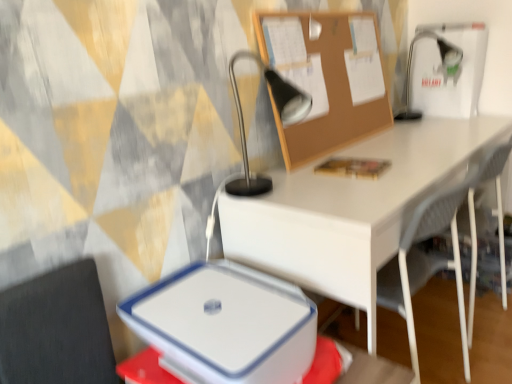
Locate an element on the screen. burlap corkboard at upper center is located at coordinates (327, 78).

Measure the distance between white plastic lunch box at lower center and camera.

They are 30.77 inches apart.

What do you see at coordinates (280, 118) in the screenshot? I see `metallic silver table lamp at upper center, the 2th table lamp in the right-to-left sequence` at bounding box center [280, 118].

Where is `white mesh chair at lower right`? white mesh chair at lower right is located at coordinates (426, 263).

From the picture: Is metallic silver table lamp at upper right, the second table lamp in the left-to-right sequence, at the back of white mesh chair at lower right?

That's not correct — white mesh chair at lower right is not looking away from metallic silver table lamp at upper right, the second table lamp in the left-to-right sequence.

Is white mesh chair at lower right thinner than metallic silver table lamp at upper right, marked as the 1th table lamp in a back-to-front arrangement?

In fact, white mesh chair at lower right might be wider than metallic silver table lamp at upper right, marked as the 1th table lamp in a back-to-front arrangement.

Can you confirm if white mesh chair at lower right is shorter than metallic silver table lamp at upper right, the second table lamp in the left-to-right sequence?

No, white mesh chair at lower right is not shorter than metallic silver table lamp at upper right, the second table lamp in the left-to-right sequence.

From the image's perspective, is white mesh chair at lower right above metallic silver table lamp at upper right, positioned as the second table lamp in front-to-back order?

Incorrect, from the image's perspective, white mesh chair at lower right is lower than metallic silver table lamp at upper right, positioned as the second table lamp in front-to-back order.

Is metallic silver table lamp at upper right, marked as the 1th table lamp in a back-to-front arrangement, a part of white plastic lunch box at lower center?

Definitely not — metallic silver table lamp at upper right, marked as the 1th table lamp in a back-to-front arrangement, is not inside white plastic lunch box at lower center.

Is white plastic lunch box at lower center taller than metallic silver table lamp at upper right, placed as the 1th table lamp when sorted from right to left?

Incorrect, the height of white plastic lunch box at lower center is not larger of that of metallic silver table lamp at upper right, placed as the 1th table lamp when sorted from right to left.

Considering the positions of objects white plastic lunch box at lower center and metallic silver table lamp at upper right, the second table lamp in the left-to-right sequence, in the image provided, who is more to the left, white plastic lunch box at lower center or metallic silver table lamp at upper right, the second table lamp in the left-to-right sequence,?

white plastic lunch box at lower center.

Is white plastic lunch box at lower center oriented towards metallic silver table lamp at upper right, the second table lamp in the left-to-right sequence?

No, white plastic lunch box at lower center does not turn towards metallic silver table lamp at upper right, the second table lamp in the left-to-right sequence.

Which object is positioned more to the left, burlap corkboard at upper center or white plastic lunch box at lower center?

white plastic lunch box at lower center is more to the left.

Between burlap corkboard at upper center and white plastic lunch box at lower center, which one has larger size?

Bigger between the two is white plastic lunch box at lower center.

From a real-world perspective, does burlap corkboard at upper center sit lower than white plastic lunch box at lower center?

No.

How far apart are metallic silver table lamp at upper center, acting as the 1th table lamp starting from the front, and white mesh chair at lower right?

metallic silver table lamp at upper center, acting as the 1th table lamp starting from the front, is 58.10 centimeters away from white mesh chair at lower right.

Between metallic silver table lamp at upper center, acting as the 1th table lamp starting from the front, and white mesh chair at lower right, which one has smaller width?

metallic silver table lamp at upper center, acting as the 1th table lamp starting from the front, is thinner.

From a real-world perspective, between metallic silver table lamp at upper center, the 2th table lamp in the right-to-left sequence, and white mesh chair at lower right, who is vertically higher?

metallic silver table lamp at upper center, the 2th table lamp in the right-to-left sequence, is physically above.

Is metallic silver table lamp at upper center, acting as the 1th table lamp starting from the front, placed right next to white mesh chair at lower right?

No, metallic silver table lamp at upper center, acting as the 1th table lamp starting from the front, is not with white mesh chair at lower right.

You are a GUI agent. You are given a task and a screenshot of the screen. Output one action in this format:
    pyautogui.click(x=<x>, y=<y>)
    Task: Click on the lunch box below the metallic silver table lamp at upper right, placed as the 1th table lamp when sorted from right to left (from a real-world perspective)
    This screenshot has height=384, width=512.
    Given the screenshot: What is the action you would take?
    pyautogui.click(x=227, y=323)

Can you confirm if metallic silver table lamp at upper right, the second table lamp in the left-to-right sequence, is wider than white plastic lunch box at lower center?

Indeed, metallic silver table lamp at upper right, the second table lamp in the left-to-right sequence, has a greater width compared to white plastic lunch box at lower center.

Is metallic silver table lamp at upper right, positioned as the second table lamp in front-to-back order, aimed at white plastic lunch box at lower center?

No, metallic silver table lamp at upper right, positioned as the second table lamp in front-to-back order, is not turned towards white plastic lunch box at lower center.

Considering the sizes of metallic silver table lamp at upper right, placed as the 1th table lamp when sorted from right to left, and white plastic lunch box at lower center in the image, is metallic silver table lamp at upper right, placed as the 1th table lamp when sorted from right to left, taller or shorter than white plastic lunch box at lower center?

In the image, metallic silver table lamp at upper right, placed as the 1th table lamp when sorted from right to left, appears to be taller than white plastic lunch box at lower center.

In terms of size, does burlap corkboard at upper center appear bigger or smaller than metallic silver table lamp at upper center, the 2th table lamp in the right-to-left sequence?

burlap corkboard at upper center is smaller than metallic silver table lamp at upper center, the 2th table lamp in the right-to-left sequence.

Is point (332, 91) positioned after point (301, 115)?

Yes, point (332, 91) is farther from viewer.

Find the location of a particular element. table lamp located below the burlap corkboard at upper center (from the image's perspective) is located at coordinates (280, 118).

Based on their sizes in the image, would you say metallic silver table lamp at upper center, the 2th table lamp in the right-to-left sequence, is bigger or smaller than metallic silver table lamp at upper right, positioned as the second table lamp in front-to-back order?

metallic silver table lamp at upper center, the 2th table lamp in the right-to-left sequence, is bigger than metallic silver table lamp at upper right, positioned as the second table lamp in front-to-back order.

Is metallic silver table lamp at upper right, the second table lamp in the left-to-right sequence, at the back of metallic silver table lamp at upper center, which is the 2th table lamp in back-to-front order?

That's not correct — metallic silver table lamp at upper center, which is the 2th table lamp in back-to-front order, is not looking away from metallic silver table lamp at upper right, the second table lamp in the left-to-right sequence.

From the image's perspective, does metallic silver table lamp at upper center, which is counted as the first table lamp, starting from the left, appear lower than metallic silver table lamp at upper right, marked as the 1th table lamp in a back-to-front arrangement?

Yes, from the image's perspective, metallic silver table lamp at upper center, which is counted as the first table lamp, starting from the left, is below metallic silver table lamp at upper right, marked as the 1th table lamp in a back-to-front arrangement.

Does metallic silver table lamp at upper center, acting as the 1th table lamp starting from the front, come behind metallic silver table lamp at upper right, positioned as the second table lamp in front-to-back order?

No, the depth of metallic silver table lamp at upper center, acting as the 1th table lamp starting from the front, is less than that of metallic silver table lamp at upper right, positioned as the second table lamp in front-to-back order.

Identify the location of armchair that is on the left side of metallic silver table lamp at upper right, marked as the 1th table lamp in a back-to-front arrangement. Image resolution: width=512 pixels, height=384 pixels. (426, 263).

From a real-world perspective, count 2nd table lamps upward from the white plastic lunch box at lower center and point to it. Please provide its 2D coordinates.

[(440, 67)]

Considering their positions, is burlap corkboard at upper center positioned further to metallic silver table lamp at upper center, acting as the 1th table lamp starting from the front, than white plastic lunch box at lower center?

white plastic lunch box at lower center lies further to metallic silver table lamp at upper center, acting as the 1th table lamp starting from the front, than the other object.

Consider the image. Estimate the real-world distances between objects in this image. Which object is closer to white mesh chair at lower right, metallic silver table lamp at upper center, which is the 2th table lamp in back-to-front order, or white plastic lunch box at lower center?

white plastic lunch box at lower center is positioned closer to the anchor white mesh chair at lower right.

From the image, which object appears to be farther from white mesh chair at lower right, white plastic lunch box at lower center or burlap corkboard at upper center?

burlap corkboard at upper center.

From the image, which object appears to be nearer to white mesh chair at lower right, burlap corkboard at upper center or metallic silver table lamp at upper right, the second table lamp in the left-to-right sequence?

burlap corkboard at upper center is closer to white mesh chair at lower right.

Estimate the real-world distances between objects in this image. Which object is further from white plastic lunch box at lower center, metallic silver table lamp at upper center, which is counted as the first table lamp, starting from the left, or metallic silver table lamp at upper right, marked as the 1th table lamp in a back-to-front arrangement?

Based on the image, metallic silver table lamp at upper right, marked as the 1th table lamp in a back-to-front arrangement, appears to be further to white plastic lunch box at lower center.

Estimate the real-world distances between objects in this image. Which object is further from burlap corkboard at upper center, white mesh chair at lower right or white plastic lunch box at lower center?

Based on the image, white plastic lunch box at lower center appears to be further to burlap corkboard at upper center.

Which object lies further to the anchor point metallic silver table lamp at upper center, the 2th table lamp in the right-to-left sequence, white mesh chair at lower right or metallic silver table lamp at upper right, the second table lamp in the left-to-right sequence?

Among the two, metallic silver table lamp at upper right, the second table lamp in the left-to-right sequence, is located further to metallic silver table lamp at upper center, the 2th table lamp in the right-to-left sequence.

Considering their positions, is white plastic lunch box at lower center positioned closer to metallic silver table lamp at upper center, the 2th table lamp in the right-to-left sequence, than metallic silver table lamp at upper right, placed as the 1th table lamp when sorted from right to left?

white plastic lunch box at lower center.

Locate an element on the screen. The width and height of the screenshot is (512, 384). table lamp between white plastic lunch box at lower center and metallic silver table lamp at upper right, positioned as the second table lamp in front-to-back order, from front to back is located at coordinates (280, 118).

The image size is (512, 384). Identify the location of bulletin board between metallic silver table lamp at upper right, marked as the 1th table lamp in a back-to-front arrangement, and white mesh chair at lower right vertically. (327, 78).

Locate an element on the screen. This screenshot has width=512, height=384. table lamp between burlap corkboard at upper center and white plastic lunch box at lower center in the up-down direction is located at coordinates (280, 118).

Identify the location of table lamp between burlap corkboard at upper center and white mesh chair at lower right from top to bottom. The image size is (512, 384). (280, 118).